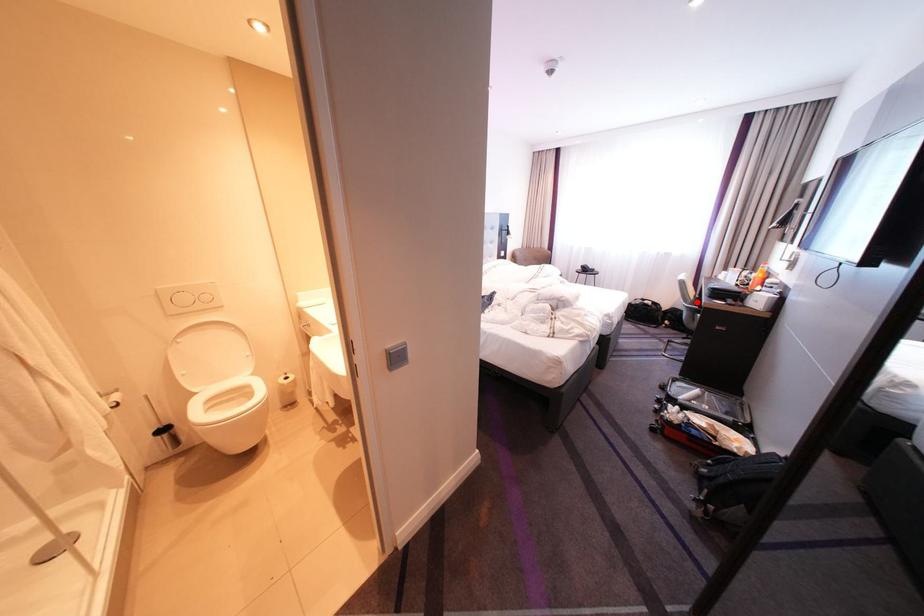
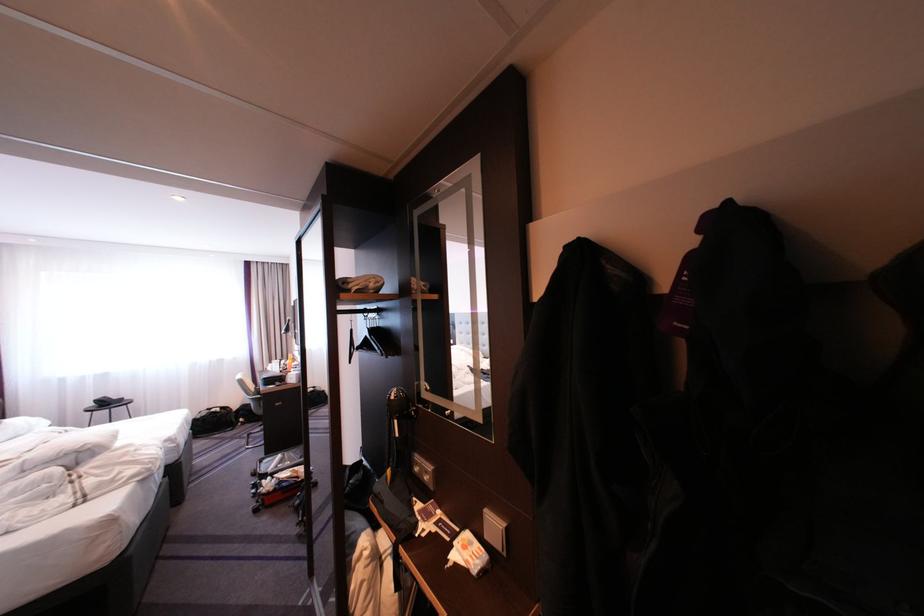
Question: A red point is marked in image1. In image2, is the corresponding 3D point closer to the camera or farther? Reply with the corresponding letter.

Choices:
 (A) The corresponding 3D point is closer.
 (B) The corresponding 3D point is farther.

Answer: (B)